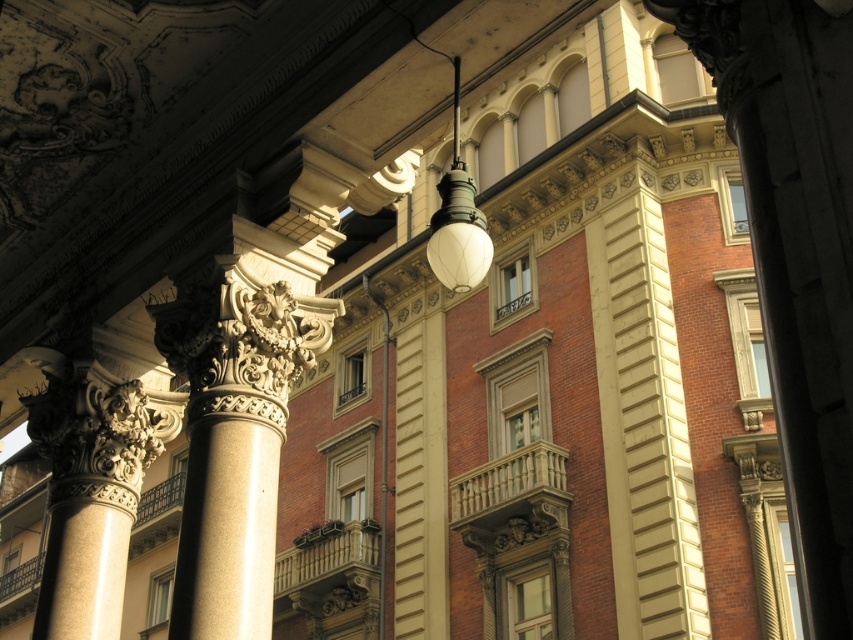
Is white marble balustrade at center shorter than dark brown wrought iron at lower left?

Correct, white marble balustrade at center is not as tall as dark brown wrought iron at lower left.

Does point (525, 460) come behind point (157, 490)?

No, (525, 460) is closer to viewer.

Identify the location of white marble balustrade at center. (508, 477).

Who is shorter, wooden balustrade at center or dark brown wrought iron at lower left?

With less height is wooden balustrade at center.

Is point (366, 560) farther from viewer compared to point (161, 499)?

No.

Where is `wooden balustrade at center`? This screenshot has height=640, width=853. wooden balustrade at center is located at coordinates (328, 554).

Which is in front, point (453, 186) or point (343, 525)?

Point (453, 186) is more forward.

Identify the location of white glass lamp at center. (457, 220).